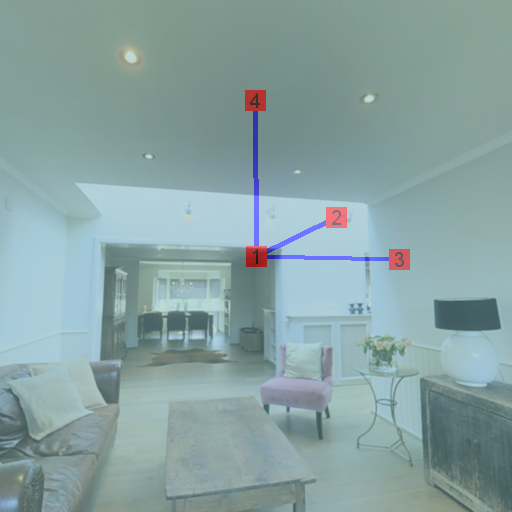
Locate an element on the screen. couch is located at coordinates (75, 448).